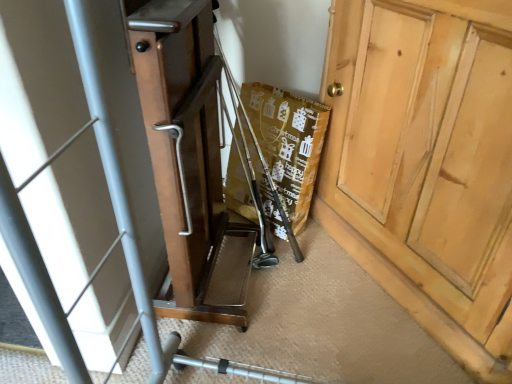
This screenshot has width=512, height=384. What do you see at coordinates (424, 168) in the screenshot?
I see `light brown wooden cabinet at right` at bounding box center [424, 168].

What is the approximate width of light brown wooden cabinet at right?

light brown wooden cabinet at right is 15.59 inches wide.

This screenshot has width=512, height=384. I want to click on light brown wooden cabinet at right, so click(x=424, y=168).

At what (x,y) coordinates should I click in order to perform the action: click on metallic silver baby carriage at lower center. Please return your answer as a coordinate pair (x, y). Looking at the image, I should click on (116, 182).

Image resolution: width=512 pixels, height=384 pixels. What do you see at coordinates (116, 182) in the screenshot?
I see `metallic silver baby carriage at lower center` at bounding box center [116, 182].

Where is `light brown wooden cabinet at right`? The height and width of the screenshot is (384, 512). light brown wooden cabinet at right is located at coordinates (424, 168).

Is metallic silver baby carriage at lower center at the right side of light brown wooden cabinet at right?

In fact, metallic silver baby carriage at lower center is to the left of light brown wooden cabinet at right.

Considering the positions of objects metallic silver baby carriage at lower center and light brown wooden cabinet at right in the image provided, who is in front, metallic silver baby carriage at lower center or light brown wooden cabinet at right?

metallic silver baby carriage at lower center is more forward.

Is point (52, 336) farther from camera compared to point (350, 188)?

No, (52, 336) is in front of (350, 188).

From the image's perspective, is metallic silver baby carriage at lower center located beneath light brown wooden cabinet at right?

Yes.

From a real-world perspective, which object stands above the other?

In real-world perspective, metallic silver baby carriage at lower center is above.

Can you confirm if metallic silver baby carriage at lower center is wider than light brown wooden cabinet at right?

Yes, metallic silver baby carriage at lower center is wider than light brown wooden cabinet at right.

Considering the sizes of metallic silver baby carriage at lower center and light brown wooden cabinet at right in the image, is metallic silver baby carriage at lower center taller or shorter than light brown wooden cabinet at right?

In the image, metallic silver baby carriage at lower center appears to be taller than light brown wooden cabinet at right.

Can you confirm if metallic silver baby carriage at lower center is smaller than light brown wooden cabinet at right?

No, metallic silver baby carriage at lower center is not smaller than light brown wooden cabinet at right.

Is metallic silver baby carriage at lower center completely or partially outside of light brown wooden cabinet at right?

Yes.

Are metallic silver baby carriage at lower center and light brown wooden cabinet at right beside each other?

No, metallic silver baby carriage at lower center is not with light brown wooden cabinet at right.

Could you tell me if metallic silver baby carriage at lower center is turned towards light brown wooden cabinet at right?

No.

In the scene shown: Can you tell me how much metallic silver baby carriage at lower center and light brown wooden cabinet at right differ in facing direction?

52.1 degrees.

Measure the distance between metallic silver baby carriage at lower center and light brown wooden cabinet at right.

metallic silver baby carriage at lower center is 22.81 inches away from light brown wooden cabinet at right.

In order to click on baby carriage on the left of the light brown wooden cabinet at right in this screenshot , I will do `click(116, 182)`.

Is light brown wooden cabinet at right at the right side of metallic silver baby carriage at lower center?

Yes.

Is light brown wooden cabinet at right in front of or behind metallic silver baby carriage at lower center in the image?

In the image, light brown wooden cabinet at right appears behind metallic silver baby carriage at lower center.

Which is farther from the camera, (390, 241) or (81, 62)?

Point (390, 241)

From the image's perspective, is light brown wooden cabinet at right under metallic silver baby carriage at lower center?

Actually, light brown wooden cabinet at right appears above metallic silver baby carriage at lower center in the image.

From a real-world perspective, is light brown wooden cabinet at right physically above metallic silver baby carriage at lower center?

No, from a real-world perspective, light brown wooden cabinet at right is not over metallic silver baby carriage at lower center

Which object is wider, light brown wooden cabinet at right or metallic silver baby carriage at lower center?

With larger width is metallic silver baby carriage at lower center.

Between light brown wooden cabinet at right and metallic silver baby carriage at lower center, which one has more height?

metallic silver baby carriage at lower center.

Considering the sizes of light brown wooden cabinet at right and metallic silver baby carriage at lower center in the image, is light brown wooden cabinet at right bigger or smaller than metallic silver baby carriage at lower center?

light brown wooden cabinet at right is smaller than metallic silver baby carriage at lower center.

Can we say light brown wooden cabinet at right lies outside metallic silver baby carriage at lower center?

Indeed, light brown wooden cabinet at right is completely outside metallic silver baby carriage at lower center.

Would you consider light brown wooden cabinet at right to be distant from metallic silver baby carriage at lower center?

They are positioned close to each other.

Is metallic silver baby carriage at lower center at the back of light brown wooden cabinet at right?

No, light brown wooden cabinet at right is not facing the opposite direction of metallic silver baby carriage at lower center.

From the picture: Could you measure the distance between light brown wooden cabinet at right and metallic silver baby carriage at lower center?

A distance of 22.81 inches exists between light brown wooden cabinet at right and metallic silver baby carriage at lower center.

The image size is (512, 384). Identify the location of door on the right of the metallic silver baby carriage at lower center. (424, 168).

Locate an element on the screen. door above the metallic silver baby carriage at lower center (from the image's perspective) is located at coordinates (424, 168).

Where is `baby carriage on the left of light brown wooden cabinet at right`? The image size is (512, 384). baby carriage on the left of light brown wooden cabinet at right is located at coordinates (116, 182).